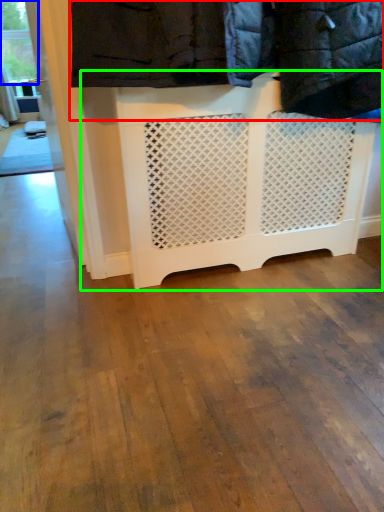
Question: Which object is the farthest from laundry (highlighted by a red box)? Choose among these: window frame (highlighted by a blue box) or furniture (highlighted by a green box).

Choices:
 (A) window frame
 (B) furniture

Answer: (A)